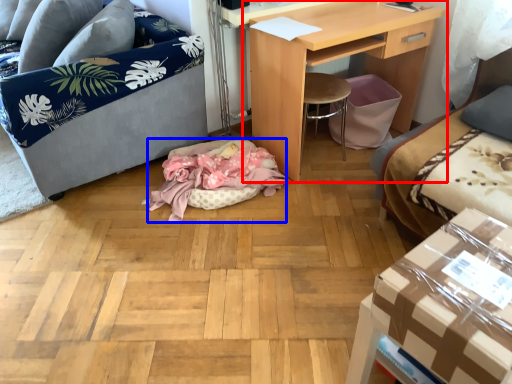
Question: Which point is closer to the camera, desk (highlighted by a red box) or cat bed (highlighted by a blue box)?

Choices:
 (A) desk
 (B) cat bed

Answer: (A)